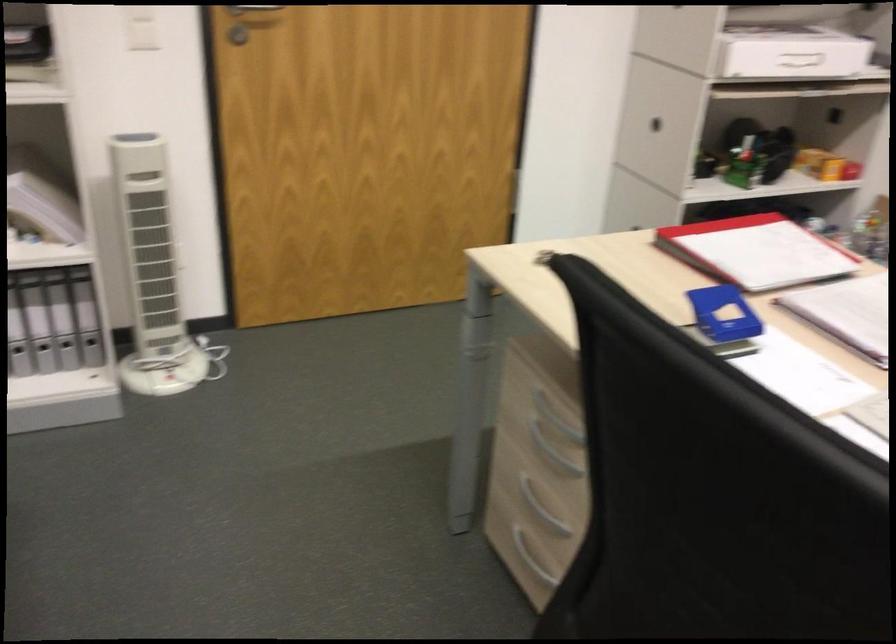
This screenshot has height=644, width=896. What are the coordinates of `silver door handle` in the screenshot? It's located at (253, 8).